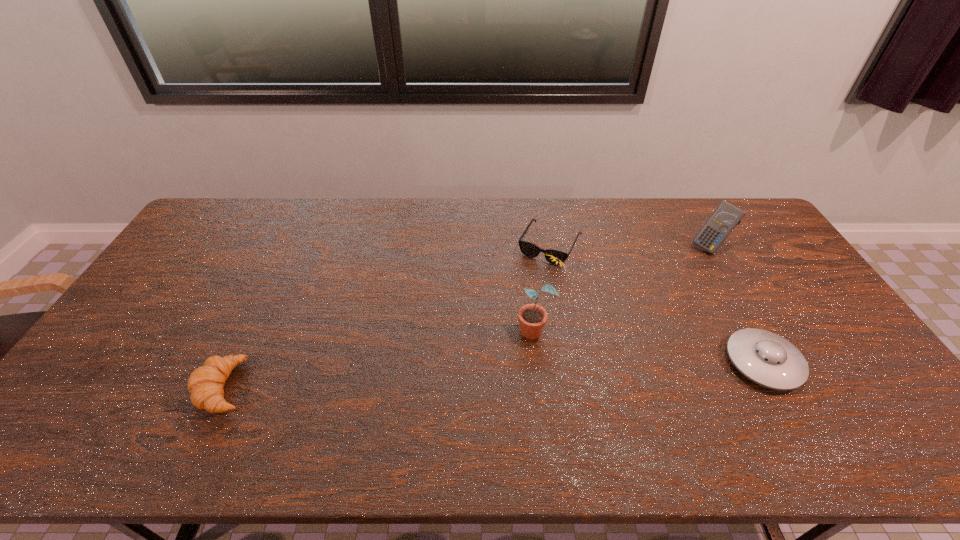
At what (x,y) coordinates should I click in order to perform the action: click on vacant spot on the desktop that is between the leftmost object and the saucer and is positioned at the front lenses of the sunglasses. Please return your answer as a coordinate pair (x, y). Looking at the image, I should click on (477, 375).

Find the location of a particular element. free spot on the desktop that is between the crescent roll and the saucer and is positioned on the flower of the sunflower is located at coordinates click(455, 376).

Where is `vacant spot on the desktop that is between the crescent roll and the saucer and is positioned on the front-facing side of the fourth shortest object`? The image size is (960, 540). vacant spot on the desktop that is between the crescent roll and the saucer and is positioned on the front-facing side of the fourth shortest object is located at coordinates (570, 371).